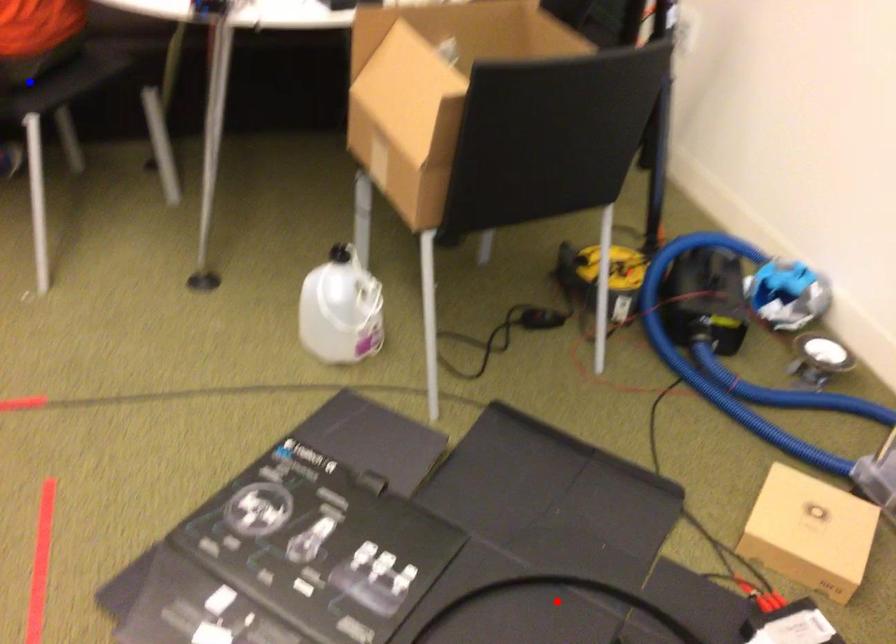
Question: In the image, two points are highlighted. Which point is nearer to the camera? Reply with the corresponding letter.

Choices:
 (A) blue point
 (B) red point

Answer: (B)